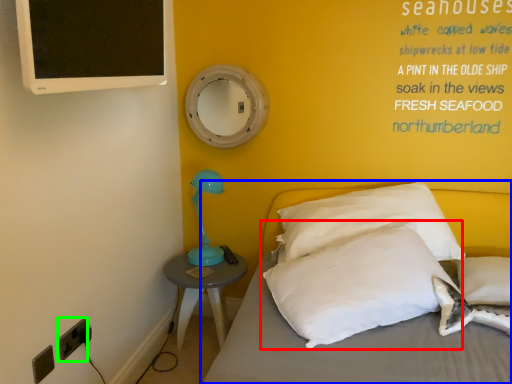
Question: Estimate the real-world distances between objects in this image. Which object is farther from pillow (highlighted by a red box), bed (highlighted by a blue box) or electric outlet (highlighted by a green box)?

Choices:
 (A) bed
 (B) electric outlet

Answer: (B)